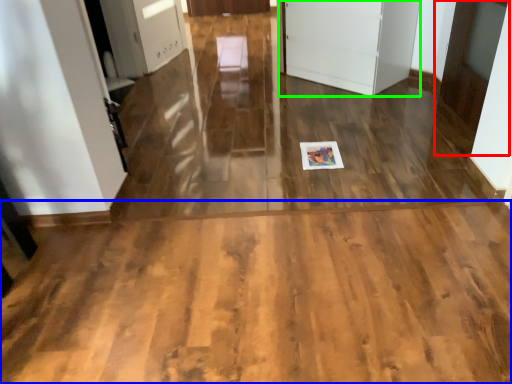
Question: Considering the real-world distances, which object is closest to door (highlighted by a red box)? corridor (highlighted by a blue box) or door (highlighted by a green box).

Choices:
 (A) corridor
 (B) door

Answer: (B)